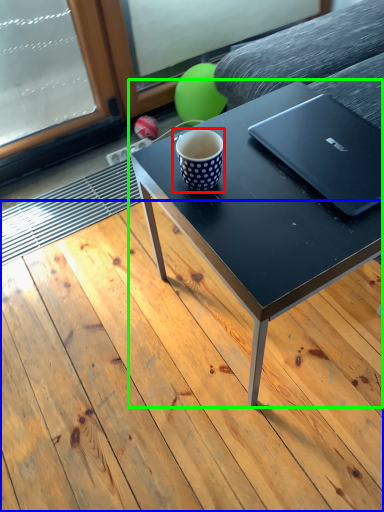
Question: Based on their relative distances, which object is farther from coffee cup (highlighted by a red box)? Choose from plank (highlighted by a blue box) and coffee table (highlighted by a green box).

Choices:
 (A) plank
 (B) coffee table

Answer: (A)